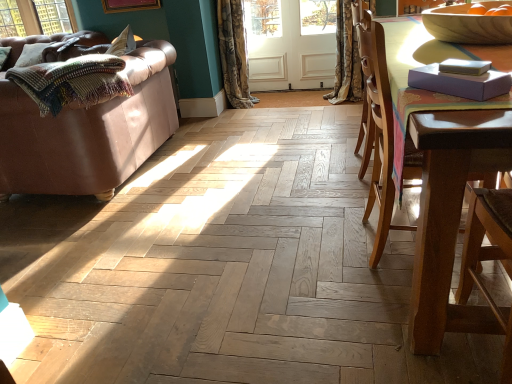
Question: Would you say textured floral curtain at center, placed as the second curtain when sorted from right to left, is part of purple matte book at upper right's contents?

Choices:
 (A) no
 (B) yes

Answer: (A)

Question: Is purple matte book at upper right wider than textured floral curtain at center, placed as the second curtain when sorted from right to left?

Choices:
 (A) no
 (B) yes

Answer: (A)

Question: From a real-world perspective, is purple matte book at upper right physically above textured floral curtain at center, arranged as the 1th curtain when viewed from the left?

Choices:
 (A) no
 (B) yes

Answer: (B)

Question: Is purple matte book at upper right far away from textured floral curtain at center, placed as the second curtain when sorted from right to left?

Choices:
 (A) yes
 (B) no

Answer: (A)

Question: Considering the relative sizes of purple matte book at upper right and textured floral curtain at center, arranged as the 1th curtain when viewed from the left, in the image provided, is purple matte book at upper right thinner than textured floral curtain at center, arranged as the 1th curtain when viewed from the left,?

Choices:
 (A) no
 (B) yes

Answer: (B)

Question: In the image, is white wood screen door at center positioned in front of or behind wooden bowl at upper right?

Choices:
 (A) front
 (B) behind

Answer: (B)

Question: Does point (301, 54) appear closer or farther from the camera than point (479, 26)?

Choices:
 (A) farther
 (B) closer

Answer: (A)

Question: From a real-world perspective, is white wood screen door at center physically located above or below wooden bowl at upper right?

Choices:
 (A) below
 (B) above

Answer: (A)

Question: Is white wood screen door at center bigger or smaller than wooden bowl at upper right?

Choices:
 (A) small
 (B) big

Answer: (B)

Question: Considering the positions of point (121, 94) and point (365, 46), is point (121, 94) closer or farther from the camera than point (365, 46)?

Choices:
 (A) farther
 (B) closer

Answer: (A)

Question: Is multicolored knitted blanket at left in front of or behind brown wooden chair at right in the image?

Choices:
 (A) behind
 (B) front

Answer: (A)

Question: From the image's perspective, is multicolored knitted blanket at left located above or below brown wooden chair at right?

Choices:
 (A) above
 (B) below

Answer: (A)

Question: Would you say multicolored knitted blanket at left is to the left or to the right of brown wooden chair at right in the picture?

Choices:
 (A) left
 (B) right

Answer: (A)

Question: Choose the correct answer: Is matte purple armchair at right inside floral fabric curtain at upper right, which is the second curtain from left to right, or outside it?

Choices:
 (A) outside
 (B) inside

Answer: (A)

Question: Considering their positions, is matte purple armchair at right located in front of or behind floral fabric curtain at upper right, which is the 1th curtain in right-to-left order?

Choices:
 (A) front
 (B) behind

Answer: (A)